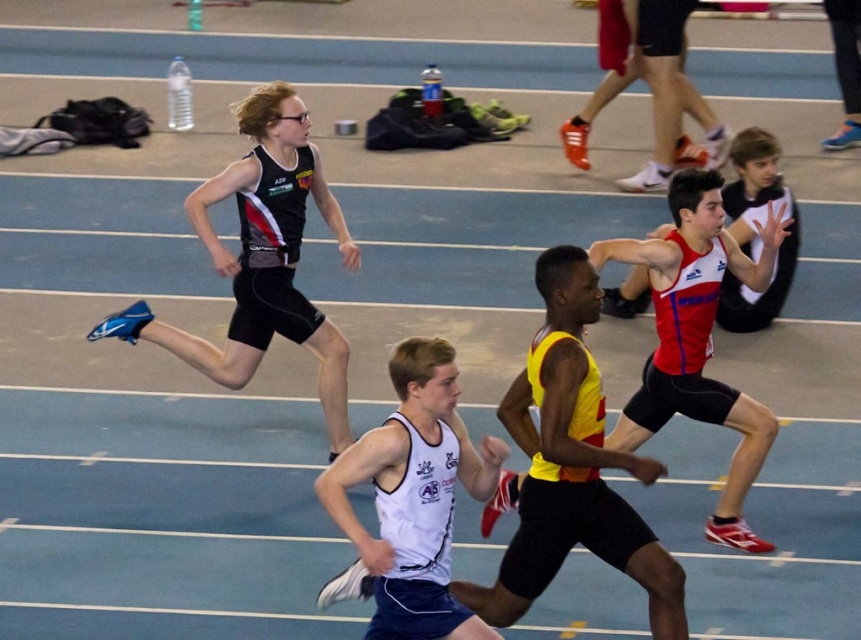
Question: Does matte black singlet at upper left have a larger size compared to red matte tank top at center?

Choices:
 (A) yes
 (B) no

Answer: (A)

Question: Does red matte tank top at center have a smaller size compared to white matte tank top at center?

Choices:
 (A) no
 (B) yes

Answer: (A)

Question: Considering the real-world distances, which object is closest to the yellow/yellowish matte tank top at center?

Choices:
 (A) matte black singlet at upper left
 (B) red matte tank top at center

Answer: (B)

Question: Which point appears closest to the camera in this image?

Choices:
 (A) (734, 253)
 (B) (332, 456)

Answer: (A)

Question: Which point is closer to the camera?

Choices:
 (A) red matte tank top at center
 (B) white matte tank top at center
 (C) yellow/yellowish matte tank top at center

Answer: (B)

Question: Observing the image, what is the correct spatial positioning of matte black singlet at upper left in reference to red matte tank top at center?

Choices:
 (A) right
 (B) left

Answer: (B)